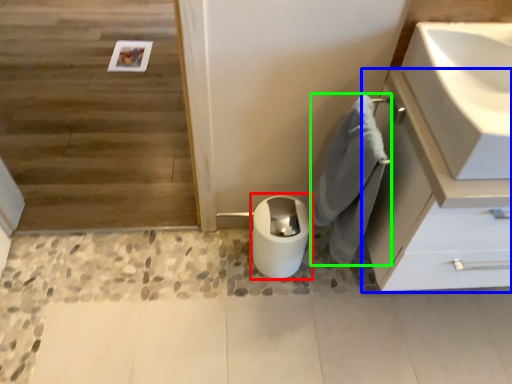
Question: Which object is positioned farthest from toilet bowl (highlighted by a red box)? Select from bathroom cabinet (highlighted by a blue box) and bath towel (highlighted by a green box).

Choices:
 (A) bathroom cabinet
 (B) bath towel

Answer: (A)